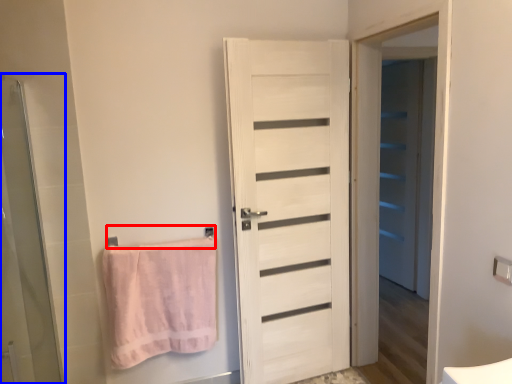
Question: Which point is closer to the camera, towel bar (highlighted by a red box) or screen door (highlighted by a blue box)?

Choices:
 (A) towel bar
 (B) screen door

Answer: (B)